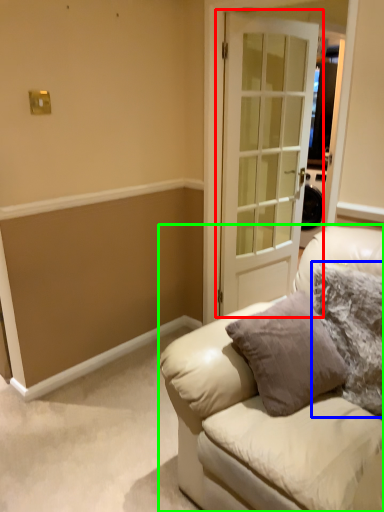
Question: Estimate the real-world distances between objects in this image. Which object is closer to door (highlighted by a red box), pillow (highlighted by a blue box) or studio couch (highlighted by a green box)?

Choices:
 (A) pillow
 (B) studio couch

Answer: (A)